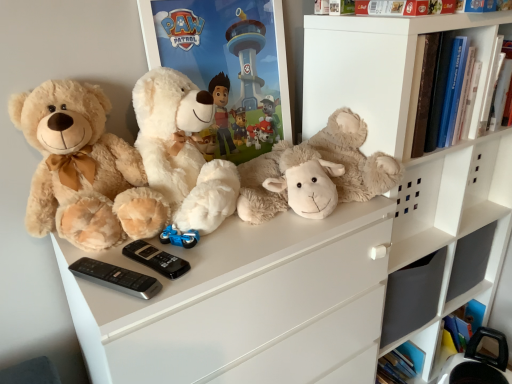
Question: From a real-world perspective, is fluffy white teddy bear at center, the second teddy bear in the right-to-left sequence, on top of white matte shelf at upper right?

Choices:
 (A) no
 (B) yes

Answer: (A)

Question: From the image's perspective, would you say fluffy white teddy bear at center, the second teddy bear in the right-to-left sequence, is shown under white matte shelf at upper right?

Choices:
 (A) yes
 (B) no

Answer: (A)

Question: Can you confirm if fluffy white teddy bear at center, the second teddy bear in the right-to-left sequence, is smaller than white matte shelf at upper right?

Choices:
 (A) no
 (B) yes

Answer: (B)

Question: Is fluffy white teddy bear at center, acting as the 2th teddy bear starting from the left, oriented away from white matte shelf at upper right?

Choices:
 (A) yes
 (B) no

Answer: (B)

Question: Considering the relative positions of fluffy white teddy bear at center, acting as the 2th teddy bear starting from the left, and white matte shelf at upper right in the image provided, is fluffy white teddy bear at center, acting as the 2th teddy bear starting from the left, to the left of white matte shelf at upper right from the viewer's perspective?

Choices:
 (A) yes
 (B) no

Answer: (A)

Question: Is black plastic remote at lower left, which appears as the 1th control when viewed from the front, bigger or smaller than white matte shelf at upper right?

Choices:
 (A) big
 (B) small

Answer: (B)

Question: Considering the relative positions of black plastic remote at lower left, which ranks as the second control in back-to-front order, and white matte shelf at upper right in the image provided, is black plastic remote at lower left, which ranks as the second control in back-to-front order, to the left or to the right of white matte shelf at upper right?

Choices:
 (A) left
 (B) right

Answer: (A)

Question: In the image, is black plastic remote at lower left, which ranks as the second control in back-to-front order, positioned in front of or behind white matte shelf at upper right?

Choices:
 (A) front
 (B) behind

Answer: (A)

Question: In terms of width, does black plastic remote at lower left, which appears as the 1th control when viewed from the front, look wider or thinner when compared to white matte shelf at upper right?

Choices:
 (A) thin
 (B) wide

Answer: (A)

Question: In terms of width, does black plastic remote at lower left, which ranks as the second control in back-to-front order, look wider or thinner when compared to black plastic remote at center, the 2th control positioned from the front?

Choices:
 (A) wide
 (B) thin

Answer: (A)

Question: Considering the positions of black plastic remote at lower left, which appears as the 1th control when viewed from the front, and black plastic remote at center, the 2th control positioned from the front, in the image, is black plastic remote at lower left, which appears as the 1th control when viewed from the front, taller or shorter than black plastic remote at center, the 2th control positioned from the front,?

Choices:
 (A) short
 (B) tall

Answer: (B)

Question: From a real-world perspective, is black plastic remote at lower left, which appears as the 1th control when viewed from the front, physically located above or below black plastic remote at center, arranged as the first control when viewed from the back?

Choices:
 (A) below
 (B) above

Answer: (B)

Question: From the image's perspective, is black plastic remote at lower left, which ranks as the second control in back-to-front order, above or below black plastic remote at center, arranged as the first control when viewed from the back?

Choices:
 (A) above
 (B) below

Answer: (B)

Question: Is point (133, 248) closer or farther from the camera than point (338, 56)?

Choices:
 (A) farther
 (B) closer

Answer: (B)

Question: Based on their positions, is black plastic remote at center, the 2th control positioned from the front, located to the left or right of white matte shelf at upper right?

Choices:
 (A) left
 (B) right

Answer: (A)